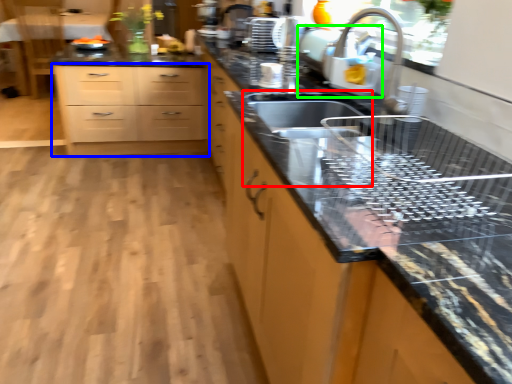
Question: Which object is positioned farthest from sink (highlighted by a red box)? Select from chest of drawers (highlighted by a blue box) and appliance (highlighted by a green box).

Choices:
 (A) chest of drawers
 (B) appliance

Answer: (A)